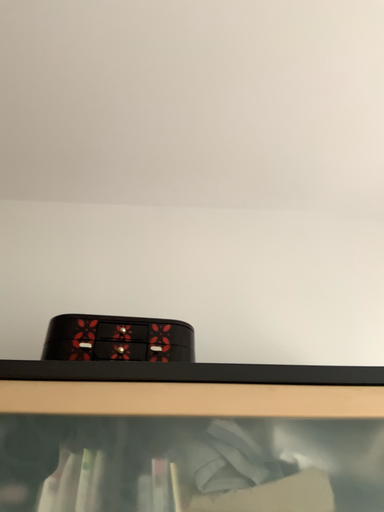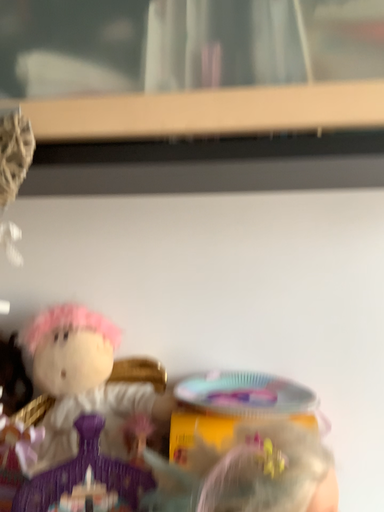
Question: Which way did the camera rotate in the video?

Choices:
 (A) rotated left
 (B) rotated right

Answer: (A)